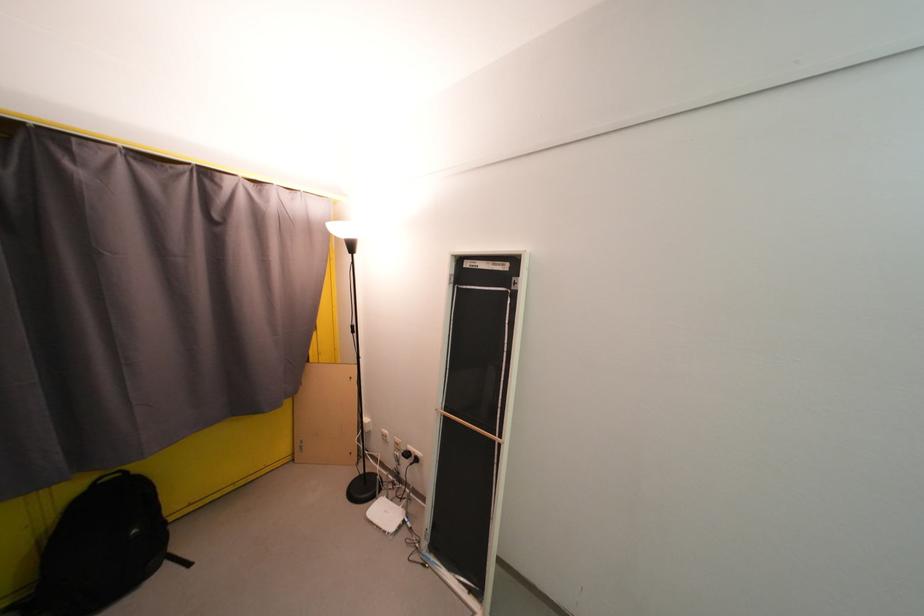
This screenshot has width=924, height=616. I want to click on black floor lamp, so click(x=345, y=331).